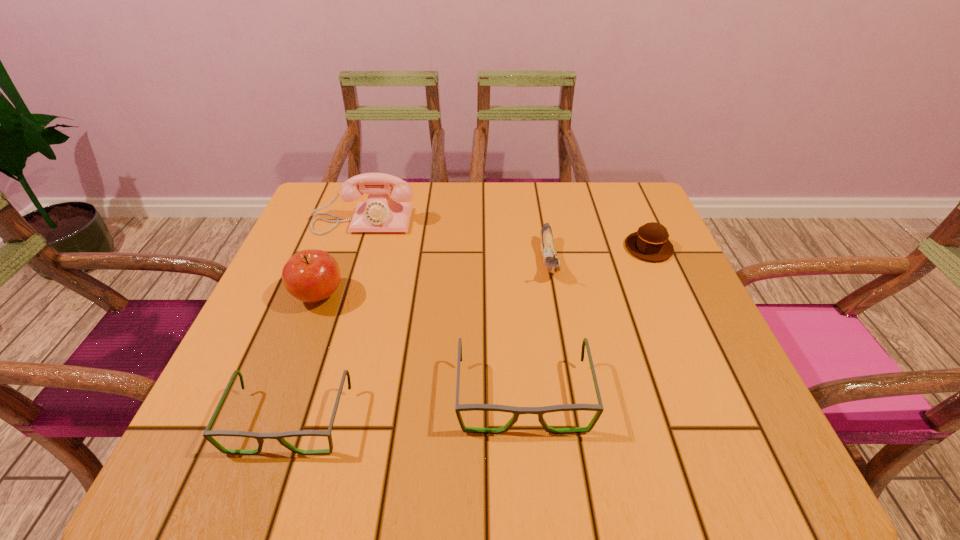
Observe the arrangement of all spectacless in the image. To keep them evenly spaced, where would you place another spectacles on the right? Please locate a free space. Please provide its 2D coordinates. Your answer should be formatted as a tuple, i.e. [(x, y)], where the tuple contains the x and y coordinates of a point satisfying the conditions above.

[(735, 373)]